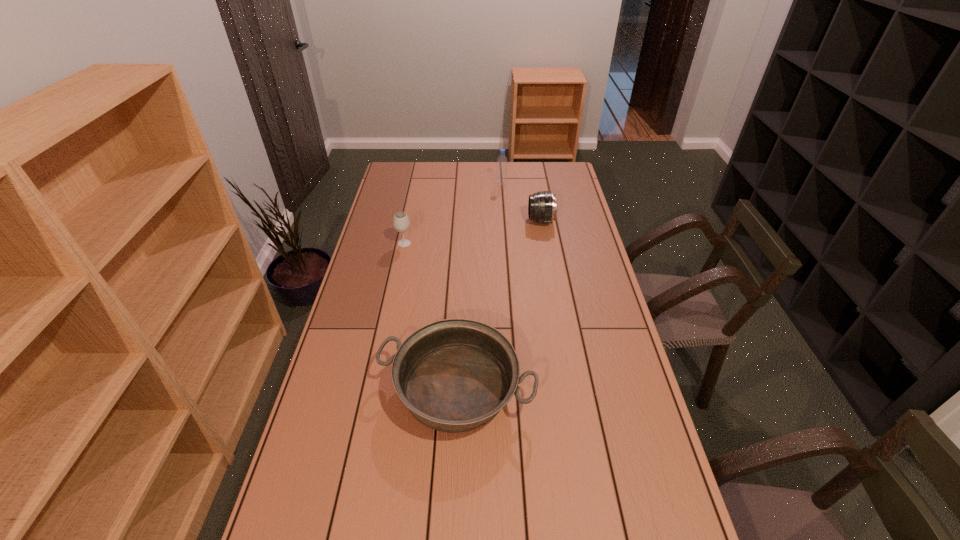
Identify the location of vacant space that satisfies the following two spatial constraints: 1. at the front element of the telephoto lens; 2. on the front side of the nearest object. This screenshot has height=540, width=960. (571, 389).